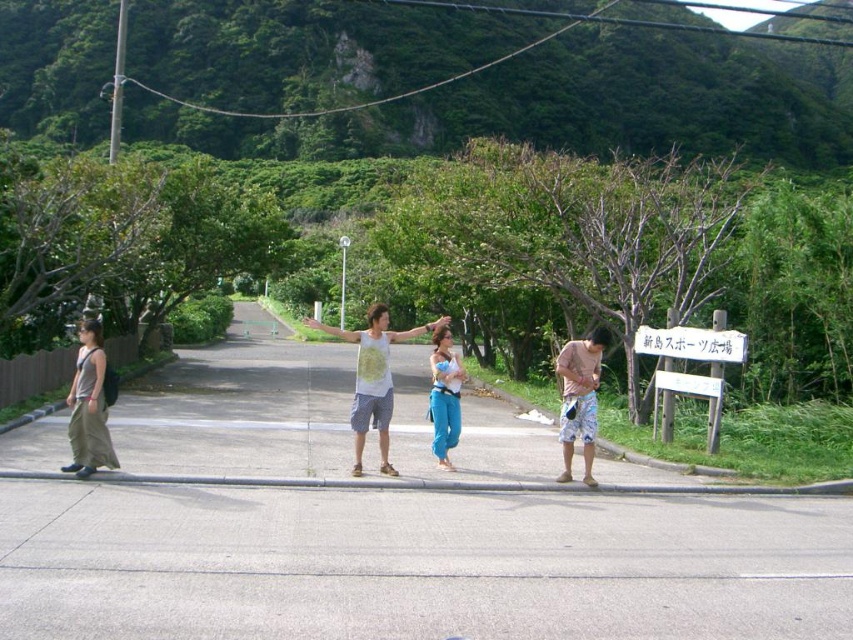
Question: Which object appears farthest from the camera in this image?

Choices:
 (A) light brown shorts at right
 (B) matte gray tank top at left
 (C) white plastic sign at center
 (D) matte white tank top at center

Answer: (C)

Question: Which of the following is the farthest from the observer?

Choices:
 (A) (370, 422)
 (B) (587, 440)

Answer: (A)

Question: Is matte gray tank top at left thinner than white plastic sign at center?

Choices:
 (A) yes
 (B) no

Answer: (A)

Question: Does matte gray tank top at left appear over light brown shorts at right?

Choices:
 (A) yes
 (B) no

Answer: (A)

Question: Can you confirm if matte white tank top at center is bigger than matte gray tank top at left?

Choices:
 (A) no
 (B) yes

Answer: (B)

Question: Which point is closer to the camera taking this photo?

Choices:
 (A) (387, 346)
 (B) (346, 248)
 (C) (717, 356)

Answer: (A)